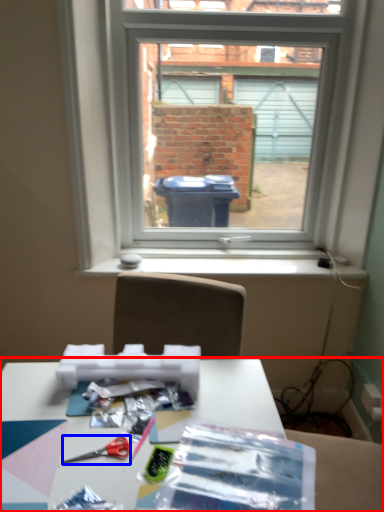
Question: Which of the following is the closest to the observer, table (highlighted by a red box) or scissors (highlighted by a blue box)?

Choices:
 (A) table
 (B) scissors

Answer: (A)